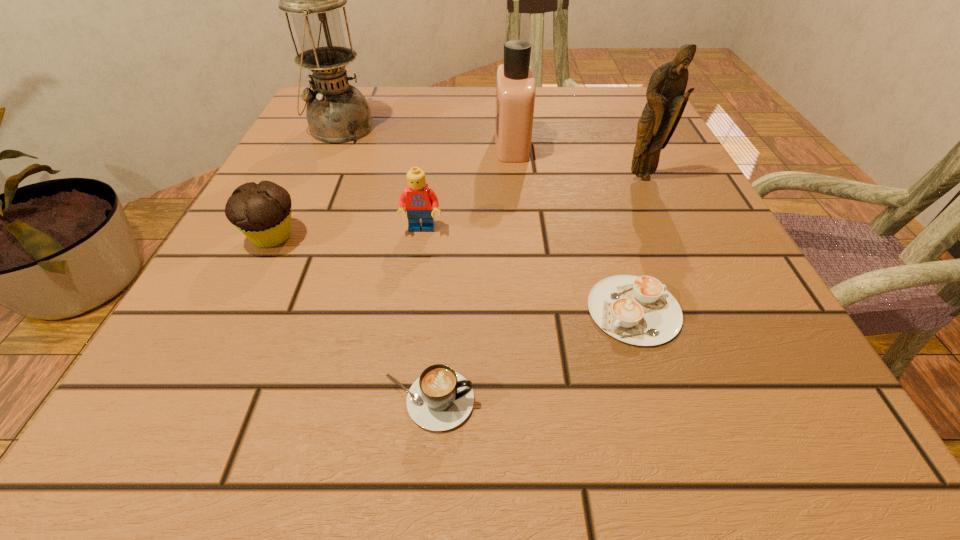
Locate an element on the screen. The image size is (960, 540). vacant space that is in between the nearest object and the figurine is located at coordinates (535, 289).

Identify the location of vacant space that is in between the third farthest object and the tallest object. (491, 153).

What are the coordinates of `empty space between the third shortest object and the second shortest object` in the screenshot? It's located at (350, 319).

Locate an element on the screen. The height and width of the screenshot is (540, 960). vacant space that's between the oil lamp and the farther cappuccino is located at coordinates (487, 219).

What are the coordinates of `object that stands as the closest to the third object from right to left` in the screenshot? It's located at (666, 99).

Locate which object is the second closest to the oil lamp. Please provide its 2D coordinates. Your answer should be formatted as a tuple, i.e. [(x, y)], where the tuple contains the x and y coordinates of a point satisfying the conditions above.

[(515, 83)]

You are a GUI agent. You are given a task and a screenshot of the screen. Output one action in this format:
    pyautogui.click(x=<x>, y=<y>)
    Task: Click on the free location that satisfies the following two spatial constraints: 1. on the front label of the third tallest object; 2. on the back side of the shorter cappuccino
    Image resolution: width=960 pixels, height=540 pixels.
    Given the screenshot: What is the action you would take?
    pyautogui.click(x=528, y=310)

The image size is (960, 540). I want to click on vacant space that satisfies the following two spatial constraints: 1. on the front label of the fifth object from left to right; 2. on the front side of the fifth tallest object, so click(x=521, y=237).

Image resolution: width=960 pixels, height=540 pixels. Identify the location of free location that satisfies the following two spatial constraints: 1. on the back side of the shortest object; 2. on the front label of the perfume. (582, 145).

You are a GUI agent. You are given a task and a screenshot of the screen. Output one action in this format:
    pyautogui.click(x=<x>, y=<y>)
    Task: Click on the free space that satisfies the following two spatial constraints: 1. on the back side of the oil lamp; 2. on the left side of the muffin
    
    Given the screenshot: What is the action you would take?
    pyautogui.click(x=326, y=128)